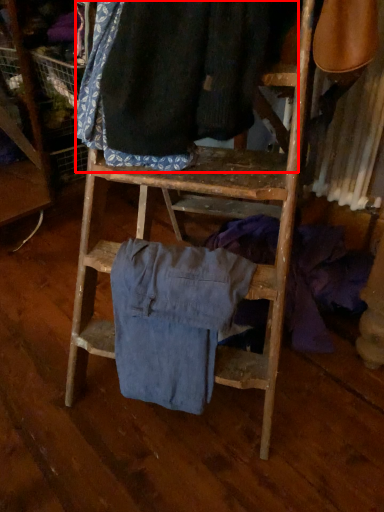
Question: From the image's perspective, where is clothing (annotated by the red box) located relative to clothing?

Choices:
 (A) below
 (B) above

Answer: (B)